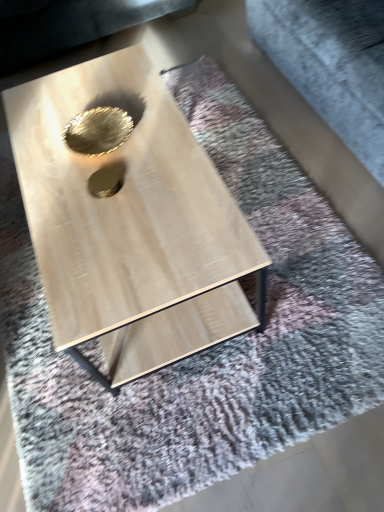
Where is `vacant space to the right of light wood/texture coffee table at center`? The height and width of the screenshot is (512, 384). vacant space to the right of light wood/texture coffee table at center is located at coordinates (291, 211).